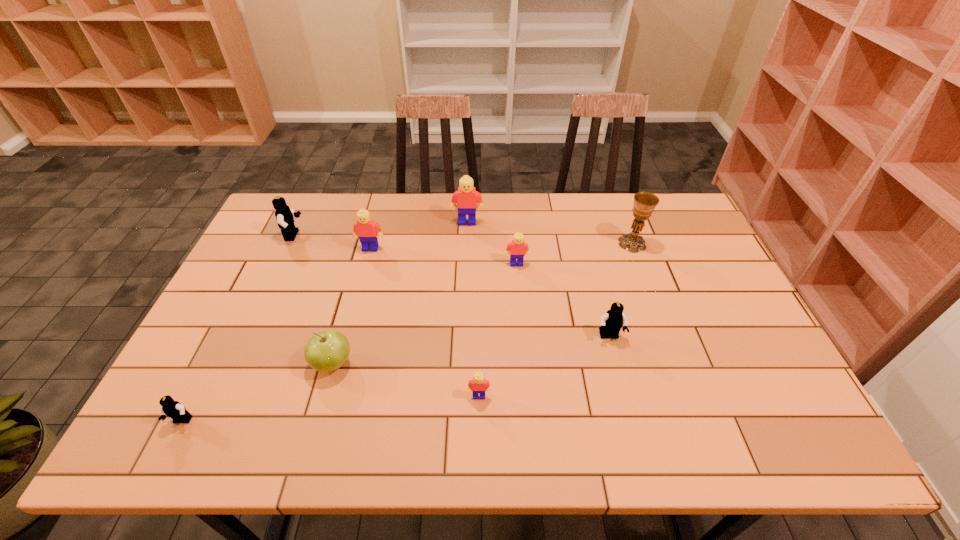
Identify the location of free space located 0.400m on the front-facing side of the sixth Lego from right to left. The width and height of the screenshot is (960, 540). (423, 236).

The image size is (960, 540). Identify the location of free space located 0.340m on the front-facing side of the second biggest yellow Lego. (347, 338).

I want to click on free region located 0.250m on the front-facing side of the fourth nearest Lego, so click(522, 332).

The image size is (960, 540). I want to click on blank space located 0.100m on the front-facing side of the fourth nearest object, so click(x=619, y=377).

At what (x,y) coordinates should I click in order to perform the action: click on vacant space located 0.100m on the back of the apple. Please return your answer as a coordinate pair (x, y). The width and height of the screenshot is (960, 540). Looking at the image, I should click on (346, 316).

The width and height of the screenshot is (960, 540). What are the coordinates of `free space located 0.100m on the front-facing side of the smallest yellow Lego` in the screenshot? It's located at (479, 441).

Identify the location of chalice at the far edge. The height and width of the screenshot is (540, 960). (644, 202).

The image size is (960, 540). Find the location of `object present at the near edge`. object present at the near edge is located at coordinates (173, 409).

At what (x,y) coordinates should I click in order to perform the action: click on object that is at the far left corner. Please return your answer as a coordinate pair (x, y). Image resolution: width=960 pixels, height=540 pixels. Looking at the image, I should click on (284, 215).

Locate an element on the screen. The width and height of the screenshot is (960, 540). object that is at the near left corner is located at coordinates (173, 409).